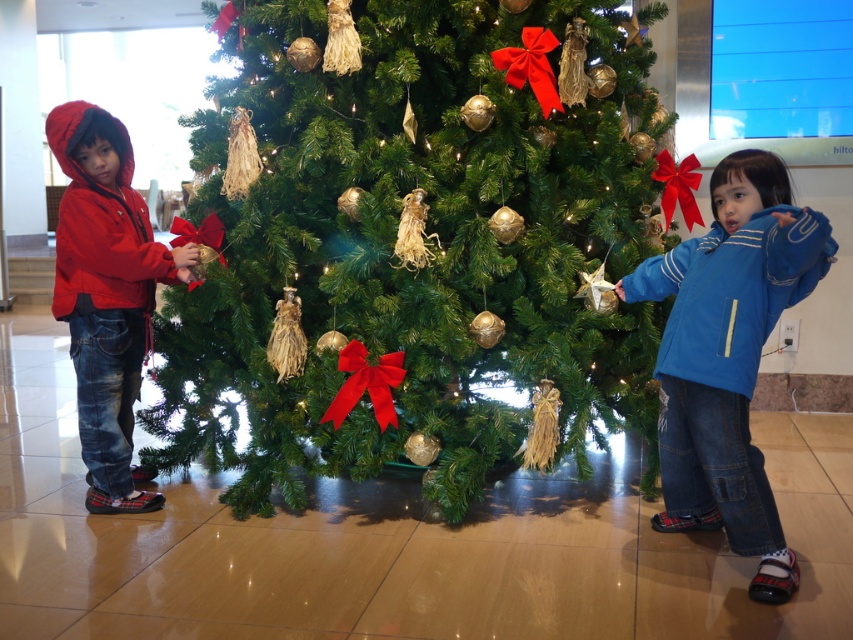
Question: Which of the following is the farthest from the observer?

Choices:
 (A) matte red jacket at left
 (B) blue fleece jacket at right
 (C) green matte christmas tree at center

Answer: (A)

Question: Which object is positioned closest to the blue fleece jacket at right?

Choices:
 (A) green matte christmas tree at center
 (B) matte red jacket at left

Answer: (A)

Question: Where is blue fleece jacket at right located in relation to matte red jacket at left in the image?

Choices:
 (A) right
 (B) left

Answer: (A)

Question: Does blue fleece jacket at right come behind matte red jacket at left?

Choices:
 (A) no
 (B) yes

Answer: (A)

Question: Which object appears farthest from the camera in this image?

Choices:
 (A) matte red jacket at left
 (B) blue fleece jacket at right

Answer: (A)

Question: Can you confirm if green matte christmas tree at center is thinner than matte red jacket at left?

Choices:
 (A) yes
 (B) no

Answer: (B)